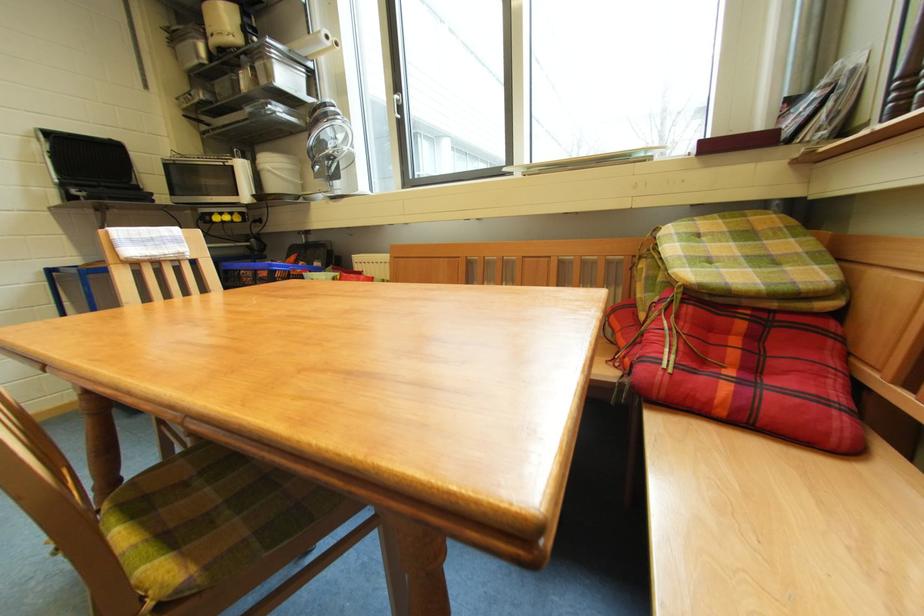
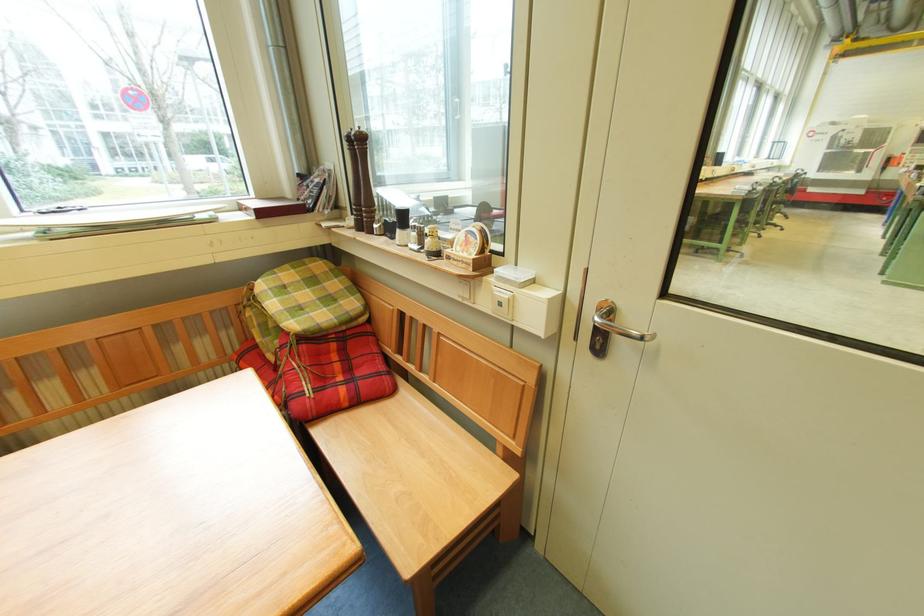
In the second image, find the point that corresponds to pixel 723 219 in the first image.

(295, 268)